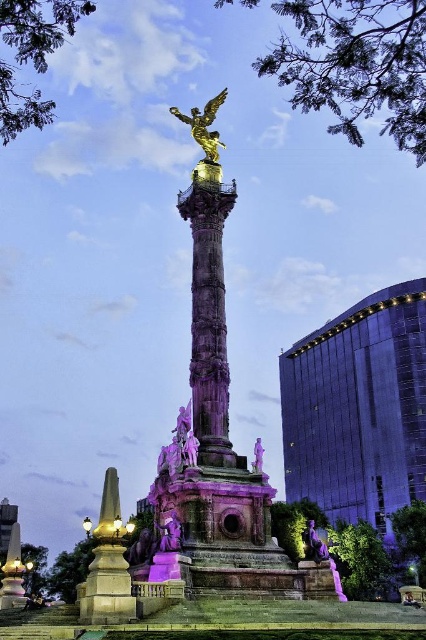
Question: Among these points, which one is farthest from the camera?

Choices:
 (A) (324, 449)
 (B) (124, 570)
 (C) (161, 531)
 (D) (213, 113)

Answer: (A)

Question: Observing the image, what is the correct spatial positioning of glossy glass building at right in reference to polished stone column at center?

Choices:
 (A) right
 (B) left

Answer: (A)

Question: Can you confirm if glossy glass building at right is bigger than gold metallic angel at upper center?

Choices:
 (A) yes
 (B) no

Answer: (A)

Question: Among these objects, which one is nearest to the camera?

Choices:
 (A) matte stone obelisk at lower left
 (B) purple stone statue at center
 (C) gold metallic angel at upper center
 (D) glossy glass building at right

Answer: (A)

Question: Which of the following is the farthest from the observer?

Choices:
 (A) polished stone column at center
 (B) glossy glass building at right

Answer: (B)

Question: Can you confirm if polished stone column at center is thinner than gold metallic angel at upper center?

Choices:
 (A) yes
 (B) no

Answer: (B)